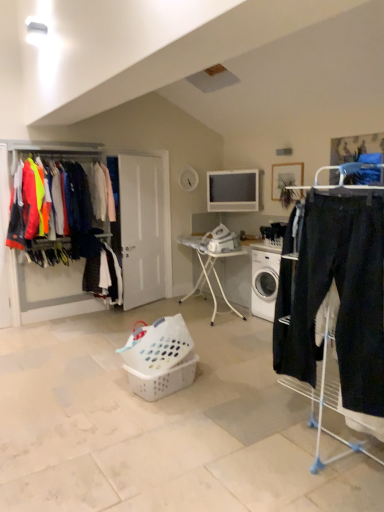
At what (x,y) coordinates should I click in order to perform the action: click on vacant area that is situated to the right of white plastic basket at center, acting as the second basket starting from the top. Please return your answer as a coordinate pair (x, y). The height and width of the screenshot is (512, 384). Looking at the image, I should click on (218, 392).